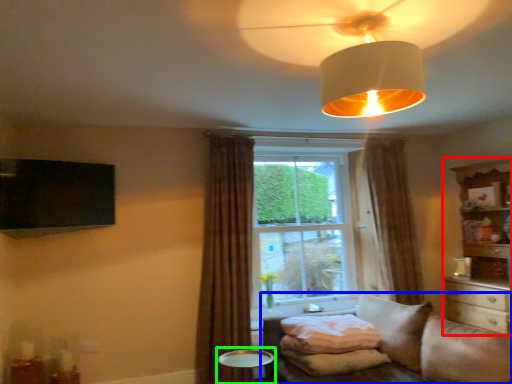
Question: Which object is the farthest from entertainment center (highlighted by a red box)? Choose among these: studio couch (highlighted by a blue box) or round table (highlighted by a green box).

Choices:
 (A) studio couch
 (B) round table

Answer: (B)